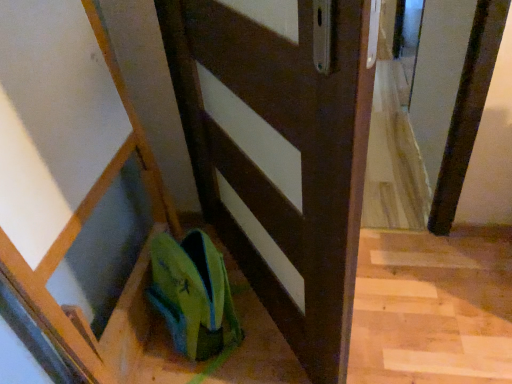
This screenshot has width=512, height=384. I want to click on matte brown door at center, so click(x=281, y=150).

This screenshot has height=384, width=512. Describe the element at coordinates (281, 150) in the screenshot. I see `matte brown door at center` at that location.

Find the location of a particular element. This screenshot has height=384, width=512. green fabric shoe at lower center is located at coordinates (193, 295).

What do you see at coordinates (193, 295) in the screenshot? Image resolution: width=512 pixels, height=384 pixels. I see `green fabric shoe at lower center` at bounding box center [193, 295].

Where is `matte brown door at center`? The image size is (512, 384). matte brown door at center is located at coordinates (281, 150).

Is green fabric shoe at lower center at the right side of matte brown door at center?

No, green fabric shoe at lower center is not to the right of matte brown door at center.

Is green fabric shoe at lower center closer to the viewer compared to matte brown door at center?

No.

Is point (190, 267) farther from viewer compared to point (336, 363)?

Yes.

From the image's perspective, relative to matte brown door at center, is green fabric shoe at lower center above or below?

From the image's perspective, green fabric shoe at lower center appears below matte brown door at center.

From a real-world perspective, does green fabric shoe at lower center sit lower than matte brown door at center?

Yes, from a real-world perspective, green fabric shoe at lower center is below matte brown door at center.

Considering the sizes of objects green fabric shoe at lower center and matte brown door at center in the image provided, who is wider, green fabric shoe at lower center or matte brown door at center?

green fabric shoe at lower center.

Considering the sizes of objects green fabric shoe at lower center and matte brown door at center in the image provided, who is shorter, green fabric shoe at lower center or matte brown door at center?

green fabric shoe at lower center is shorter.

Is green fabric shoe at lower center bigger or smaller than matte brown door at center?

In the image, green fabric shoe at lower center appears to be smaller than matte brown door at center.

Does green fabric shoe at lower center contain matte brown door at center?

Actually, matte brown door at center is outside green fabric shoe at lower center.

Is green fabric shoe at lower center touching matte brown door at center?

No, green fabric shoe at lower center is not touching matte brown door at center.

Does green fabric shoe at lower center turn towards matte brown door at center?

No, green fabric shoe at lower center is not turned towards matte brown door at center.

What's the angular difference between green fabric shoe at lower center and matte brown door at center's facing directions?

The facing directions of green fabric shoe at lower center and matte brown door at center are 81.8 degrees apart.

At what (x,y) coordinates should I click in order to perform the action: click on door above the green fabric shoe at lower center (from the image's perspective). Please return your answer as a coordinate pair (x, y). Looking at the image, I should click on (281, 150).

Is matte brown door at center to the left of green fabric shoe at lower center from the viewer's perspective?

No.

Which object is closer to the camera, matte brown door at center or green fabric shoe at lower center?

matte brown door at center is more forward.

Between point (301, 24) and point (228, 312), which one is positioned in front?

The point (301, 24) is closer.

From the image's perspective, which one is positioned higher, matte brown door at center or green fabric shoe at lower center?

matte brown door at center, from the image's perspective.

From a real-world perspective, is matte brown door at center physically below green fabric shoe at lower center?

No, from a real-world perspective, matte brown door at center is not beneath green fabric shoe at lower center.

Does matte brown door at center have a lesser width compared to green fabric shoe at lower center?

Indeed, matte brown door at center has a lesser width compared to green fabric shoe at lower center.

Between matte brown door at center and green fabric shoe at lower center, which one has less height?

green fabric shoe at lower center is shorter.

Is matte brown door at center bigger than green fabric shoe at lower center?

Indeed, matte brown door at center has a larger size compared to green fabric shoe at lower center.

Is matte brown door at center spatially inside green fabric shoe at lower center, or outside of it?

matte brown door at center is outside green fabric shoe at lower center.

Is matte brown door at center positioned far away from green fabric shoe at lower center?

No, matte brown door at center is in close proximity to green fabric shoe at lower center.

Is matte brown door at center aimed at green fabric shoe at lower center?

Yes, matte brown door at center is facing green fabric shoe at lower center.

Where is `door on the right side of green fabric shoe at lower center`? This screenshot has width=512, height=384. door on the right side of green fabric shoe at lower center is located at coordinates [x=281, y=150].

This screenshot has height=384, width=512. I want to click on shoe on the left of matte brown door at center, so click(x=193, y=295).

Where is `shoe below the matte brown door at center (from the image's perspective)`? shoe below the matte brown door at center (from the image's perspective) is located at coordinates (193, 295).